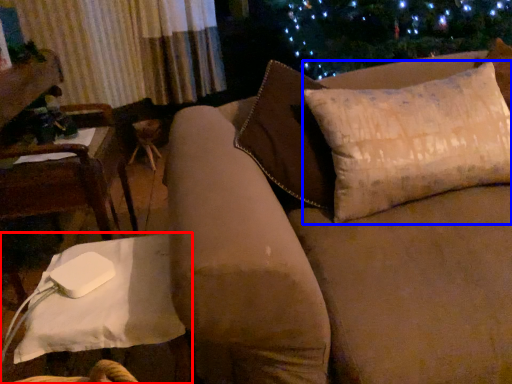
Question: Which point is closer to the camera, table (highlighted by a red box) or pillow (highlighted by a blue box)?

Choices:
 (A) table
 (B) pillow

Answer: (A)